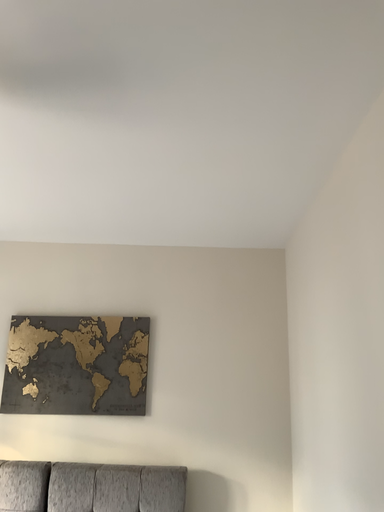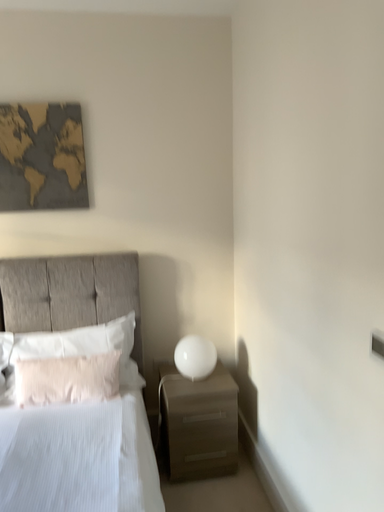
Question: Which way did the camera rotate in the video?

Choices:
 (A) rotated left
 (B) rotated right

Answer: (B)